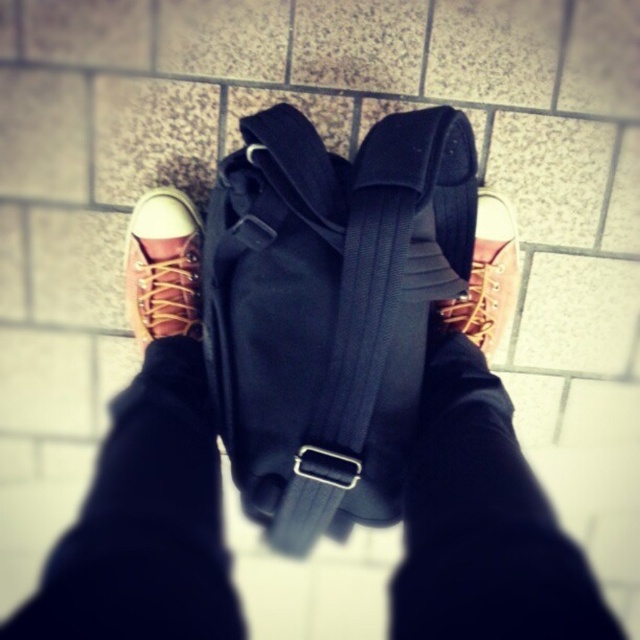
Who is taller, matte black backpack at center or black fabric backpack at center?

black fabric backpack at center is taller.

Who is more forward, [196,452] or [456,170]?

Point [196,452] is in front.

This screenshot has width=640, height=640. What do you see at coordinates (148, 472) in the screenshot?
I see `matte black backpack at center` at bounding box center [148, 472].

I want to click on matte black backpack at center, so click(x=148, y=472).

Is the position of matte black backpack at center more distant than that of matte brown canvas shoe at center?

No.

You are a GUI agent. You are given a task and a screenshot of the screen. Output one action in this format:
    pyautogui.click(x=<x>, y=<y>)
    Task: Click on the matte black backpack at center
    
    Given the screenshot: What is the action you would take?
    pyautogui.click(x=148, y=472)

Who is more distant from viewer, [467,428] or [157,324]?

A: The point [157,324] is more distant.

The width and height of the screenshot is (640, 640). I want to click on matte black backpack at center, so (148, 472).

Consider the image. Between black fabric backpack at center and matte brown canvas shoe at center, which one is positioned higher?

matte brown canvas shoe at center is above.

Does black fabric backpack at center have a lesser height compared to matte brown canvas shoe at center?

No.

The image size is (640, 640). Find the location of `black fabric backpack at center`. black fabric backpack at center is located at coordinates (330, 308).

Identify the location of black fabric backpack at center. (330, 308).